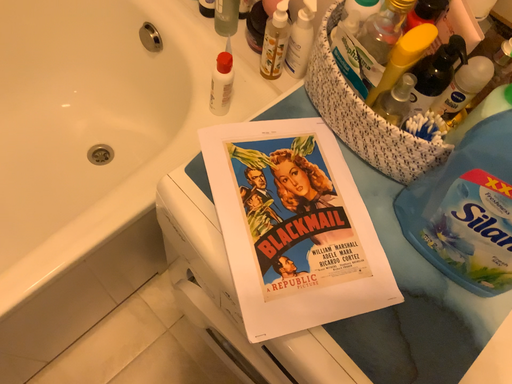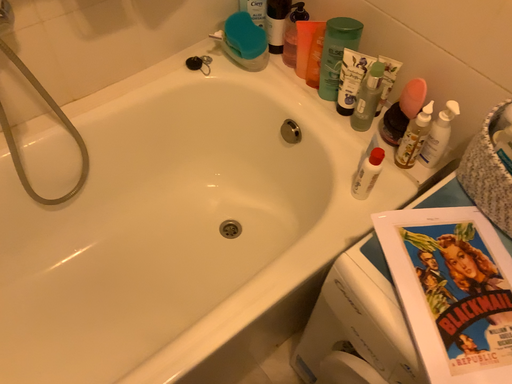
Question: Which way did the camera rotate in the video?

Choices:
 (A) rotated right
 (B) rotated left

Answer: (B)